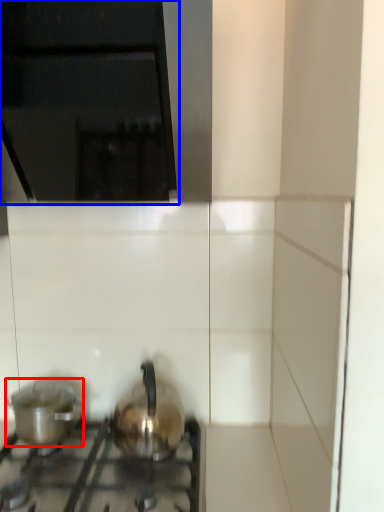
Question: Which object is closer to the camera taking this photo, kitchen appliance (highlighted by a red box) or vent (highlighted by a blue box)?

Choices:
 (A) kitchen appliance
 (B) vent

Answer: (B)